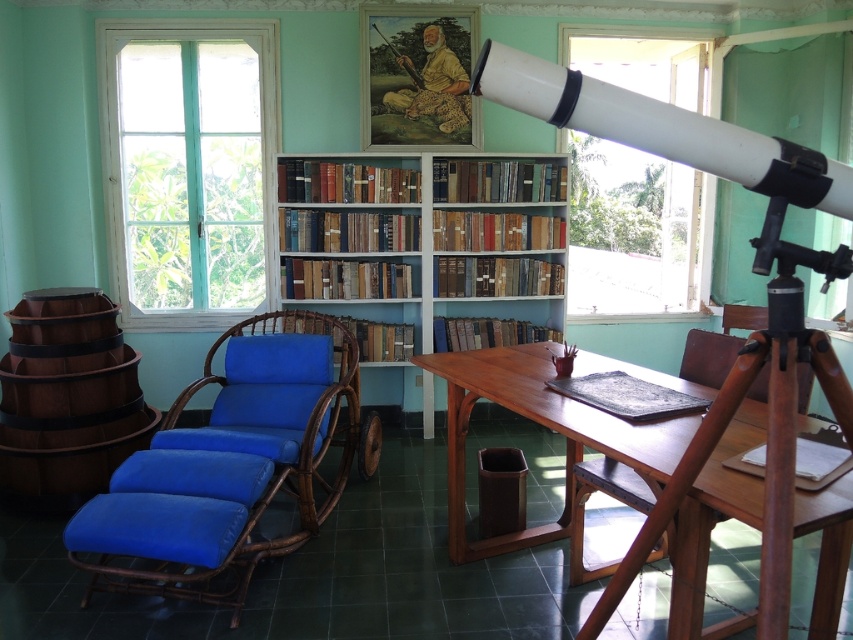
You are sitting in the blue fabric armchair at center and want to reach the blue woven armchair at center. Which direction should you move to get there?

You should move to your left because the blue woven armchair at center is located to the left of the blue fabric armchair at center.

From the picture: You are sitting in the blue fabric armchair at center and want to reach a book from the wooden bookcase at center. Can you easily reach it without getting up?

The wooden bookcase at center is located above the blue fabric armchair at center, so the bottom shelves of the wooden bookcase at center may be within reach, but the higher shelves might require standing to access.